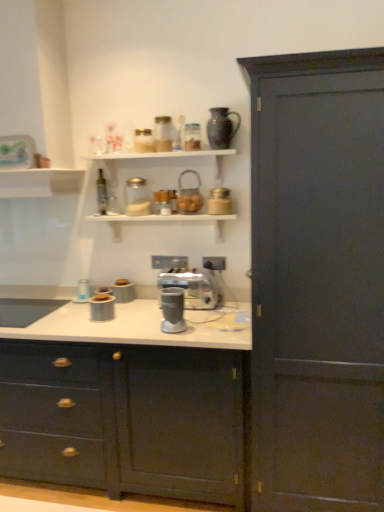
Question: Do you think metallic silver blender at center is within satin silver coffee machine at center, or outside of it?

Choices:
 (A) inside
 (B) outside

Answer: (B)

Question: Based on their sizes in the image, would you say metallic silver blender at center is bigger or smaller than satin silver coffee machine at center?

Choices:
 (A) small
 (B) big

Answer: (B)

Question: Which of these objects is positioned farthest from the matte dark wood cabinet at right, the 2th cabinetry positioned from the left?

Choices:
 (A) satin silver coffee machine at center
 (B) matte black vase at upper center
 (C) matte ceramic canister at center, positioned as the second appliance in left-to-right order
 (D) metallic silver blender at center
 (E) translucent glass basket at upper center, positioned as the 2th appliance in right-to-left order

Answer: (C)

Question: Considering the real-world distances, which object is closest to the matte dark blue cabinet at center, positioned as the 2th cabinetry in right-to-left order?

Choices:
 (A) matte black vase at upper center
 (B) matte plastic container at center, acting as the 1th appliance starting from the bottom
 (C) white matte shelf at upper center
 (D) matte ceramic canister at center, the fourth appliance positioned from the right
 (E) satin silver coffee machine at center

Answer: (E)